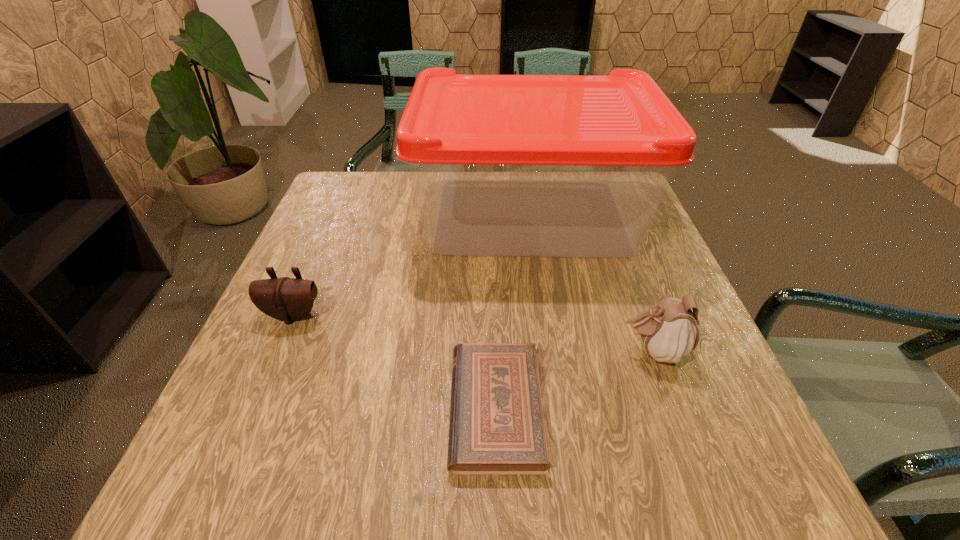
Where is `the tallest object`? the tallest object is located at coordinates (503, 165).

This screenshot has height=540, width=960. In order to click on the farthest object in this screenshot , I will do `click(503, 165)`.

Identify the location of the second tallest object. (669, 331).

Identify the location of the nearer pouch. The image size is (960, 540). (669, 331).

The image size is (960, 540). In order to click on the second farthest object in this screenshot , I will do `click(288, 299)`.

At what (x,y) coordinates should I click in order to perform the action: click on the shorter pouch. Please return your answer as a coordinate pair (x, y). This screenshot has height=540, width=960. Looking at the image, I should click on (288, 299).

This screenshot has width=960, height=540. In order to click on Bible in this screenshot , I will do `click(496, 426)`.

Identify the location of free spot located 0.090m on the front of the tray. (541, 299).

The width and height of the screenshot is (960, 540). What are the coordinates of `free space located on the front-facing side of the nearer pouch` in the screenshot? It's located at (425, 351).

At what (x,y) coordinates should I click in order to perform the action: click on vacant position located on the front-facing side of the nearer pouch. Please return your answer as a coordinate pair (x, y). Looking at the image, I should click on coord(536,351).